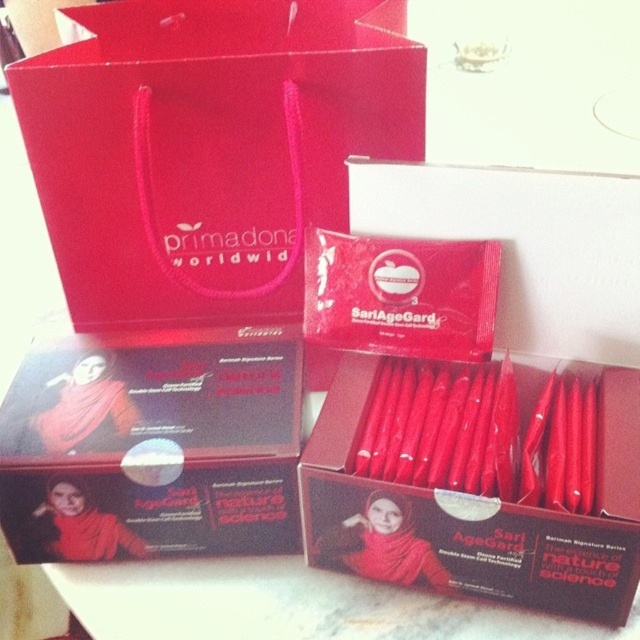
Question: Does matte paper bag at upper left have a smaller size compared to matte black box at center?

Choices:
 (A) yes
 (B) no

Answer: (B)

Question: Considering the relative positions of matte red packet at center and matte black box at center in the image provided, where is matte red packet at center located with respect to matte black box at center?

Choices:
 (A) below
 (B) above

Answer: (A)

Question: Considering the real-world distances, which object is farthest from the matte red packet at center?

Choices:
 (A) matte black box at center
 (B) matte paper bag at upper left

Answer: (B)

Question: Can you confirm if matte paper bag at upper left is positioned above matte black box at center?

Choices:
 (A) no
 (B) yes

Answer: (B)

Question: Which point is closer to the camera taking this photo?

Choices:
 (A) (419, 560)
 (B) (189, 390)

Answer: (A)

Question: Which is nearer to the matte paper bag at upper left?

Choices:
 (A) matte red packet at center
 (B) matte black box at center

Answer: (B)